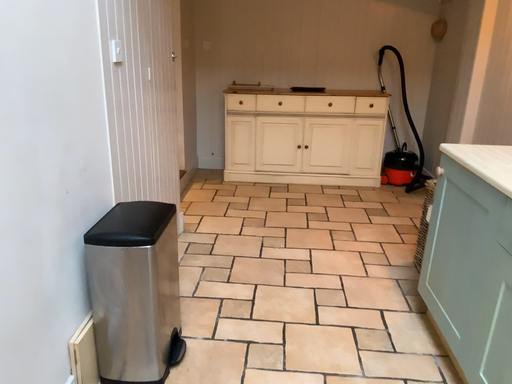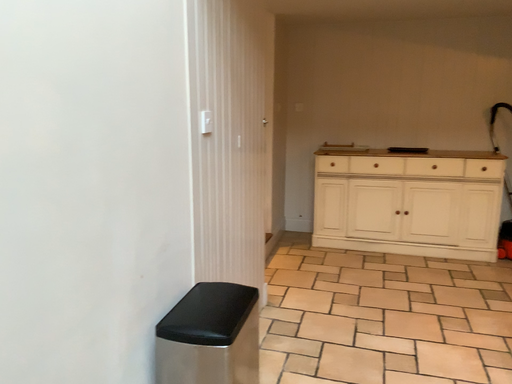
Question: Which way did the camera rotate in the video?

Choices:
 (A) rotated left
 (B) rotated right

Answer: (A)